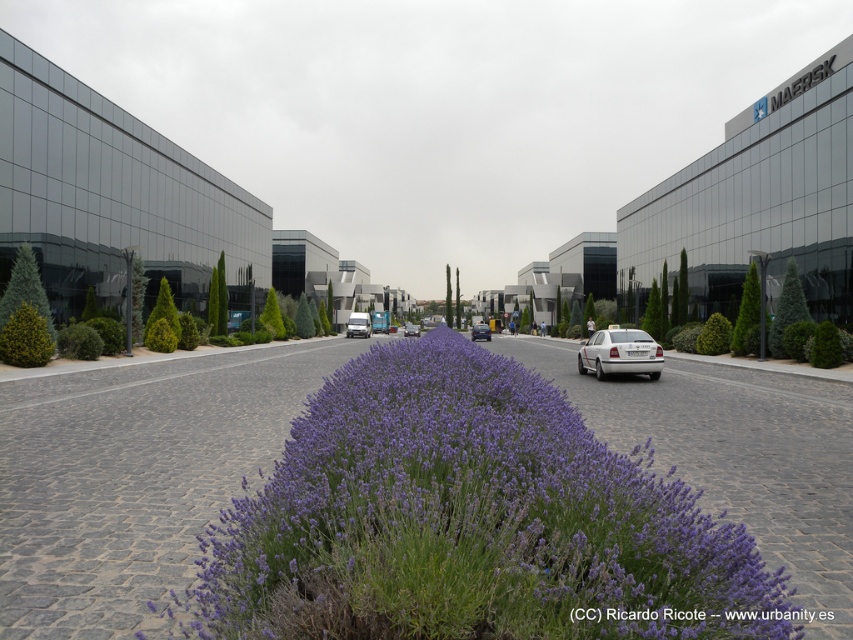
Question: Which point is closer to the camera taking this photo?

Choices:
 (A) (482, 337)
 (B) (635, 372)
 (C) (366, 336)
 (D) (412, 336)

Answer: (B)

Question: Does matte white van at center have a lesser width compared to metallic silver van at center?

Choices:
 (A) yes
 (B) no

Answer: (A)

Question: Can you confirm if purple soft-textured lavender at center is positioned below white glossy sedan at center?

Choices:
 (A) yes
 (B) no

Answer: (A)

Question: Can you confirm if white glossy sedan at center is wider than metallic silver van at center?

Choices:
 (A) yes
 (B) no

Answer: (A)

Question: Among these objects, which one is nearest to the camera?

Choices:
 (A) metallic silver van at center
 (B) matte white van at center

Answer: (B)

Question: Estimate the real-world distances between objects in this image. Which object is closer to the matte white van at center?

Choices:
 (A) white glossy sedan at center
 (B) purple soft-textured lavender at center
 (C) metallic silver van at center

Answer: (A)